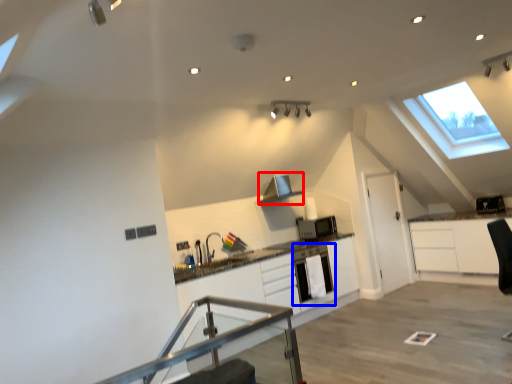
Question: Which object is further to the camera taking this photo, exhaust hood (highlighted by a red box) or dish washer (highlighted by a blue box)?

Choices:
 (A) exhaust hood
 (B) dish washer

Answer: (A)